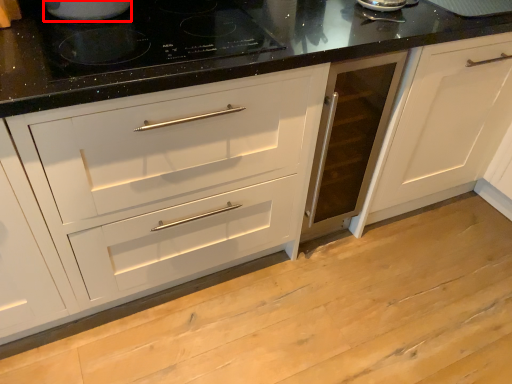
Question: From the image's perspective, what is the correct spatial positioning of appliance (annotated by the red box) in reference to gas stove?

Choices:
 (A) above
 (B) below

Answer: (A)